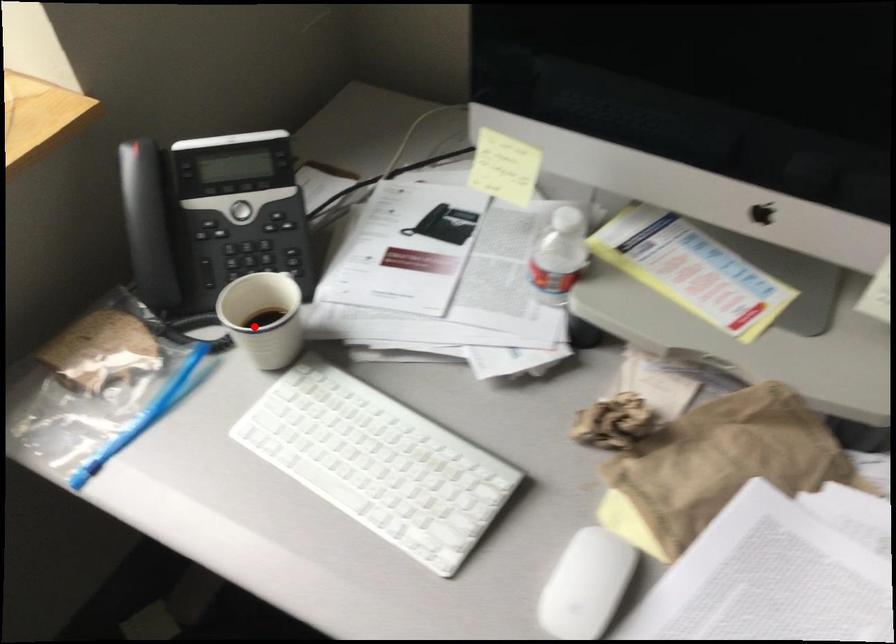
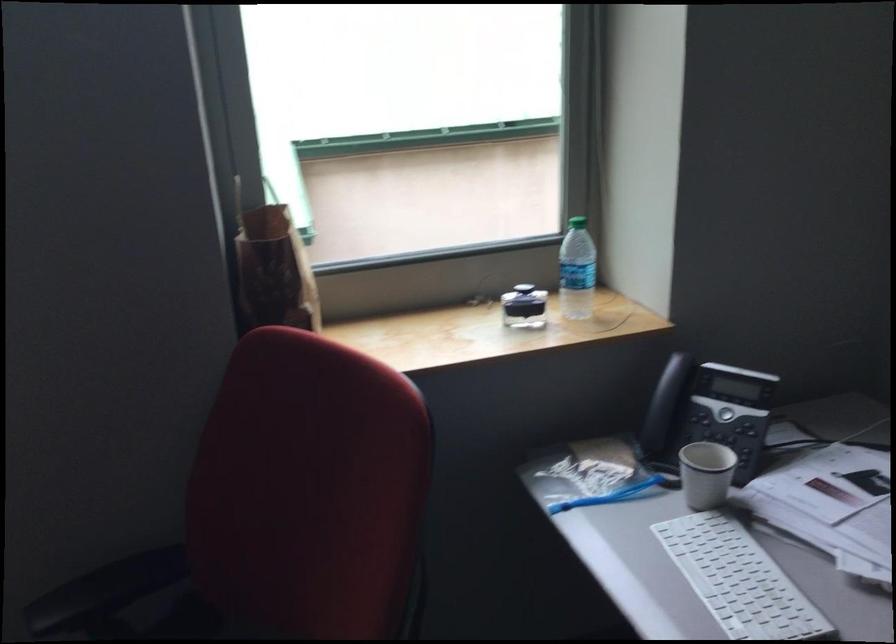
Question: I am providing you with two images of the same scene from different viewpoints. Image1 has a red point marked. In image2, the corresponding 3D location appears at what relative position? Reply with the corresponding letter.

Choices:
 (A) Closer
 (B) Farther

Answer: (B)